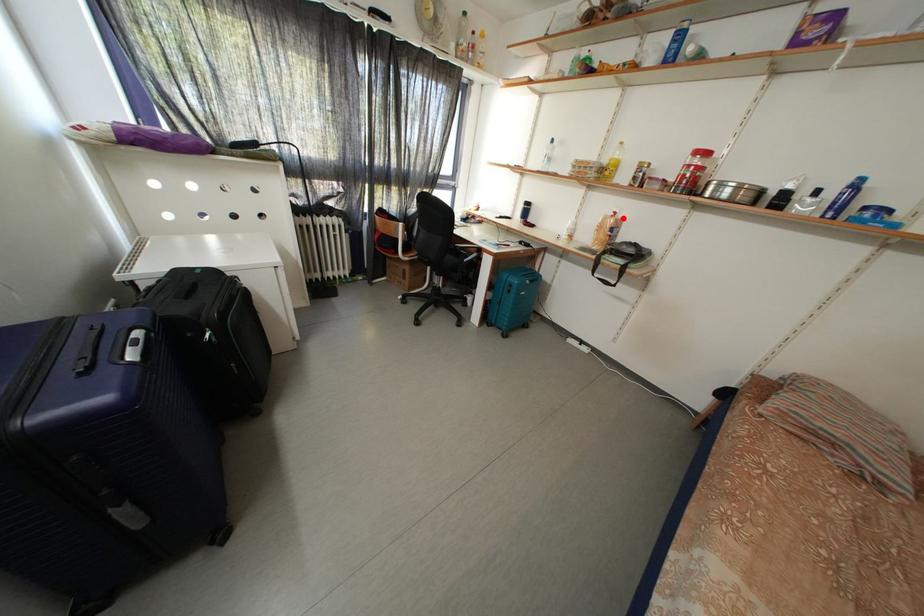
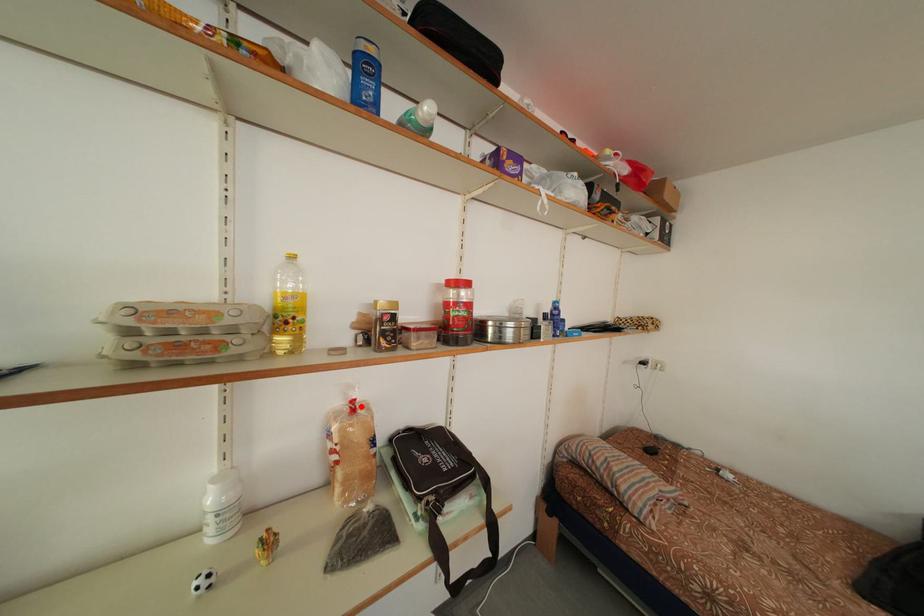
I am providing you with two images of the same scene from different viewpoints. A red point is marked on the first image and another point is marked on the second image. Are the points marked in image1 and image2 representing the same 3D position?

Yes